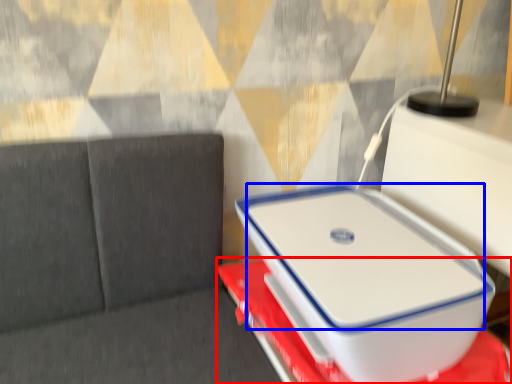
Question: Which object is further to the camera taking this photo, furniture (highlighted by a red box) or laptop (highlighted by a blue box)?

Choices:
 (A) furniture
 (B) laptop

Answer: (B)